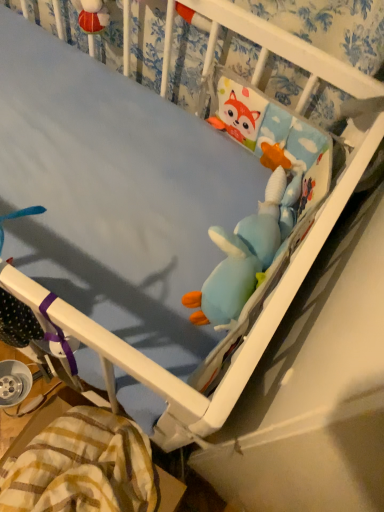
Question: From the image's perspective, is yellow plaid blanket at lower left located above or below blue plush toy at center, the 1th toy in the bottom-to-top sequence?

Choices:
 (A) below
 (B) above

Answer: (A)

Question: Is point (61, 435) positioned closer to the camera than point (215, 313)?

Choices:
 (A) farther
 (B) closer

Answer: (A)

Question: Estimate the real-world distances between objects in this image. Which object is closer to the yellow plaid blanket at lower left?

Choices:
 (A) soft plush toy at upper right, acting as the 2th toy starting from the bottom
 (B) blue plush toy at center, which is counted as the second toy, starting from the top

Answer: (B)

Question: Considering the real-world distances, which object is closest to the yellow plaid blanket at lower left?

Choices:
 (A) blue plush toy at center, which is counted as the second toy, starting from the top
 (B) soft plush toy at upper right, acting as the 2th toy starting from the bottom

Answer: (A)